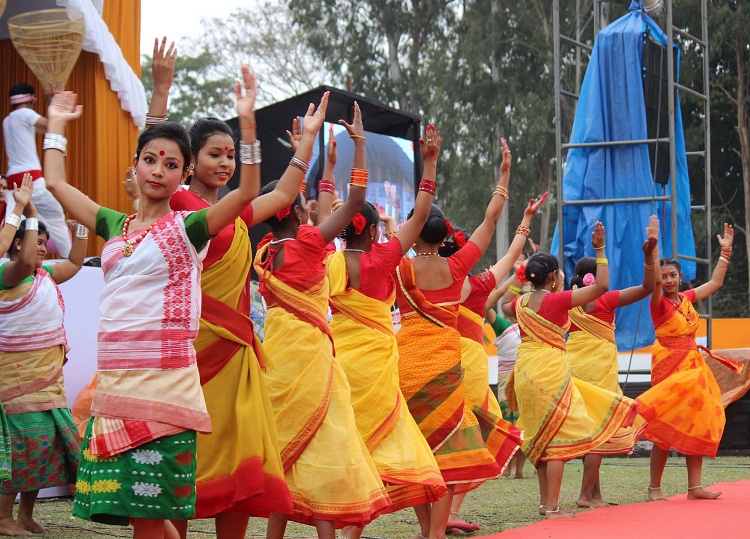
Where is `stage`? The height and width of the screenshot is (539, 750). stage is located at coordinates (685, 505).